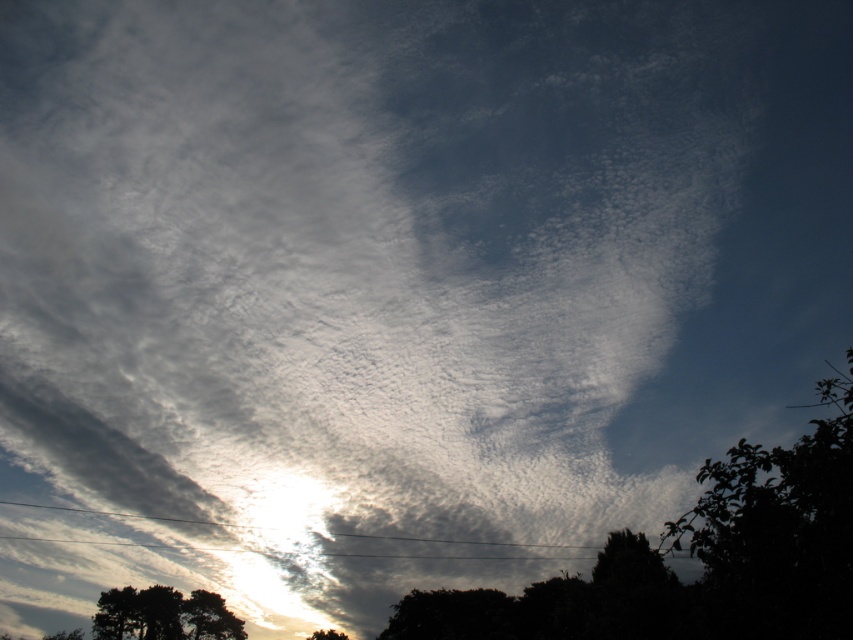
You are an artist trying to paint this sky scene. You want to ensure the green leafy tree at lower right and the silhouette bark tree at lower left are proportionally accurate. Based on the scene, which tree should you paint larger?

The green leafy tree at lower right should be painted larger because it is bigger than the silhouette bark tree at lower left according to the description.

You are an astronomer observing the sky scene. You notice two points marked at coordinates point (840, 625) and point (456, 609). Which point is nearer to your viewpoint?

Point (840, 625) is closer to the camera than point (456, 609), so the point (840, 625) is nearer to your viewpoint.